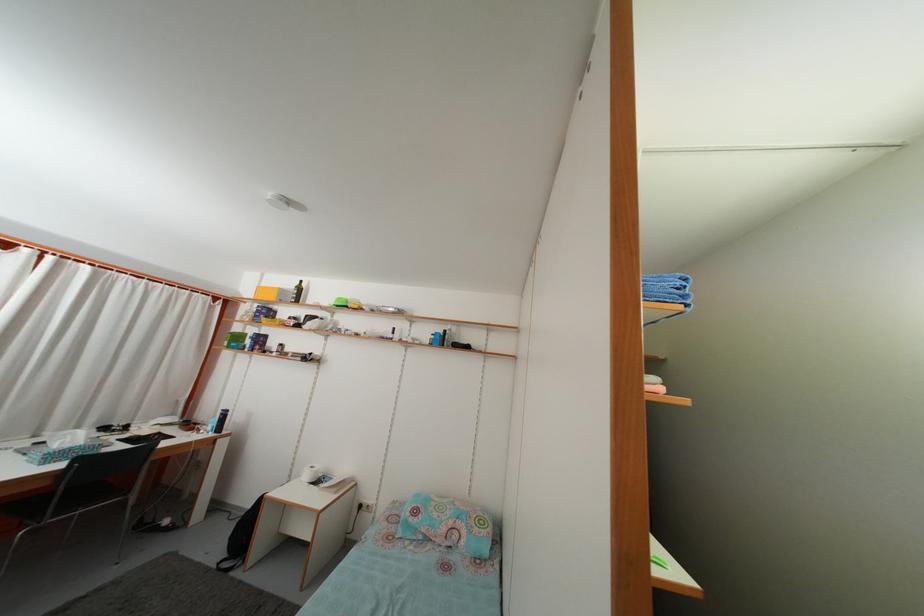
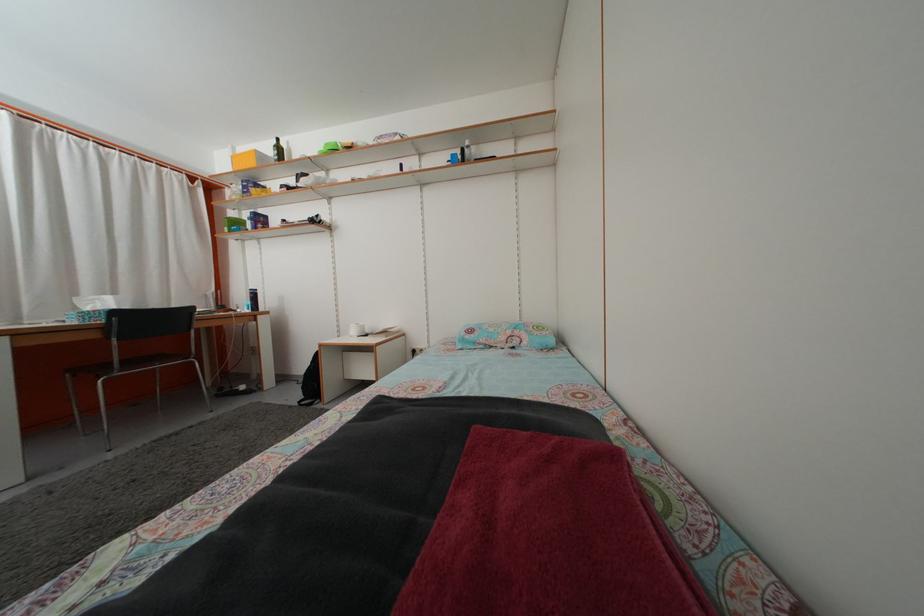
The images are taken continuously from a first-person perspective. In which direction are you moving?

The movement direction of the cameraman is left, forward.